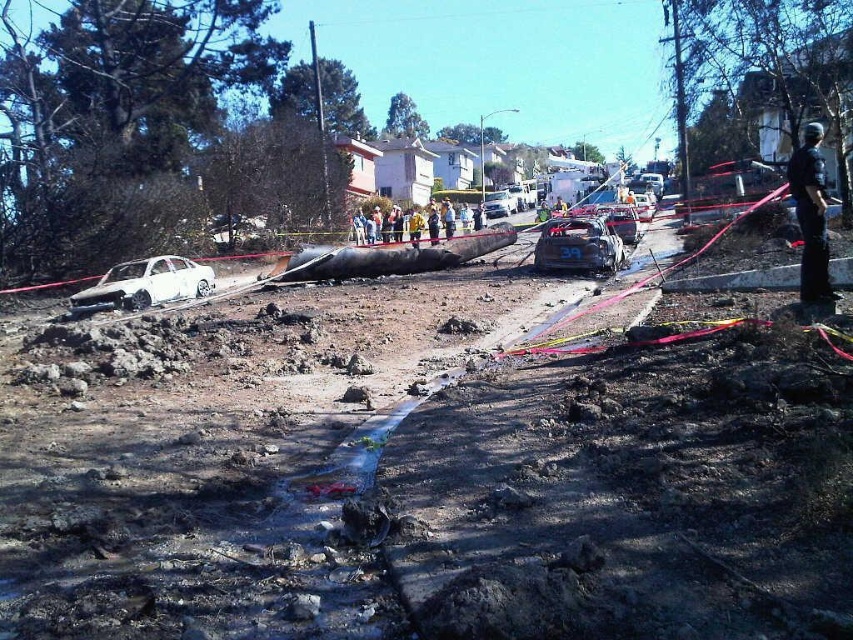
Can you confirm if yellow uniformed person at center is thinner than yellow fabric person at center?

No.

Measure the distance from yellow uniformed person at center to yellow fabric person at center.

They are 2.09 meters apart.

Identify the location of yellow uniformed person at center. (393, 224).

Between dark blue uniform at right and burnt metallic car at center, which one is positioned lower?

burnt metallic car at center is below.

Does point (804, 269) come in front of point (538, 243)?

Yes.

Where is `dark blue uniform at right`? The height and width of the screenshot is (640, 853). dark blue uniform at right is located at coordinates (810, 216).

Does point (550, 253) come behind point (409, 227)?

No, (550, 253) is closer to viewer.

Is burnt metallic car at center to the left of yellow fabric person at center from the viewer's perspective?

In fact, burnt metallic car at center is to the right of yellow fabric person at center.

Which is behind, point (548, 262) or point (409, 221)?

Point (409, 221)

You are a GUI agent. You are given a task and a screenshot of the screen. Output one action in this format:
    pyautogui.click(x=<x>, y=<y>)
    Task: Click on the burnt metallic car at center
    
    Given the screenshot: What is the action you would take?
    tap(577, 244)